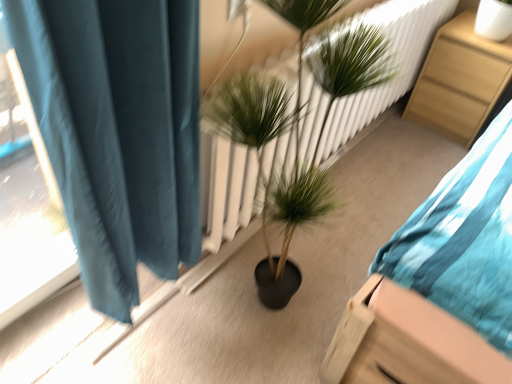
This screenshot has width=512, height=384. What do you see at coordinates (276, 181) in the screenshot?
I see `green leafy plant at center` at bounding box center [276, 181].

Locate an element on the screen. green leafy plant at center is located at coordinates (276, 181).

Looking at this image, measure the distance between point [472,62] and camera.

Point [472,62] and camera are 2.10 meters apart.

What do you see at coordinates (459, 80) in the screenshot? The height and width of the screenshot is (384, 512). I see `wooden nightstand at right` at bounding box center [459, 80].

The width and height of the screenshot is (512, 384). Identify the location of wooden nightstand at right. (459, 80).

What is the approximate width of wooden nightstand at right?

The width of wooden nightstand at right is 18.06 inches.

This screenshot has height=384, width=512. Find the location of `green leafy plant at center`. green leafy plant at center is located at coordinates (276, 181).

Is green leafy plant at center at the left side of wooden nightstand at right?

Correct, you'll find green leafy plant at center to the left of wooden nightstand at right.

Which object is closer to the camera, green leafy plant at center or wooden nightstand at right?

green leafy plant at center is more forward.

Does point (331, 7) come closer to viewer compared to point (486, 90)?

Yes, point (331, 7) is in front of point (486, 90).

From the image's perspective, does green leafy plant at center appear lower than wooden nightstand at right?

Yes.

From a real-world perspective, who is located lower, green leafy plant at center or wooden nightstand at right?

wooden nightstand at right.

Considering the sizes of objects green leafy plant at center and wooden nightstand at right in the image provided, who is thinner, green leafy plant at center or wooden nightstand at right?

green leafy plant at center is thinner.

Between green leafy plant at center and wooden nightstand at right, which one has less height?

wooden nightstand at right.

Between green leafy plant at center and wooden nightstand at right, which one has smaller size?

With smaller size is wooden nightstand at right.

Is green leafy plant at center completely or partially outside of wooden nightstand at right?

Absolutely, green leafy plant at center is external to wooden nightstand at right.

Is green leafy plant at center far from wooden nightstand at right?

green leafy plant at center is far away from wooden nightstand at right.

Is green leafy plant at center facing towards wooden nightstand at right?

No, green leafy plant at center is not oriented towards wooden nightstand at right.

How many degrees apart are the facing directions of green leafy plant at center and wooden nightstand at right?

The facing directions of green leafy plant at center and wooden nightstand at right are 95.8 degrees apart.

How far apart are green leafy plant at center and wooden nightstand at right?

green leafy plant at center is 1.19 meters from wooden nightstand at right.

Where is `houseplant that is above the wooden nightstand at right (from a real-world perspective)`? The height and width of the screenshot is (384, 512). houseplant that is above the wooden nightstand at right (from a real-world perspective) is located at coordinates (276, 181).

Is wooden nightstand at right to the right of green leafy plant at center from the viewer's perspective?

Yes.

Does wooden nightstand at right come behind green leafy plant at center?

Yes, wooden nightstand at right is behind green leafy plant at center.

Considering the points (432, 62) and (234, 90), which point is behind, point (432, 62) or point (234, 90)?

The point (432, 62) is more distant.

From the image's perspective, would you say wooden nightstand at right is positioned over green leafy plant at center?

Indeed, from the image's perspective, wooden nightstand at right is shown above green leafy plant at center.

From a real-world perspective, is wooden nightstand at right positioned over green leafy plant at center based on gravity?

No, from a real-world perspective, wooden nightstand at right is not on top of green leafy plant at center.

Looking at this image, between wooden nightstand at right and green leafy plant at center, which one has larger width?

With larger width is wooden nightstand at right.

Can you confirm if wooden nightstand at right is shorter than green leafy plant at center?

Yes.

Is wooden nightstand at right bigger than green leafy plant at center?

No, wooden nightstand at right is not bigger than green leafy plant at center.

Would you say wooden nightstand at right is inside or outside green leafy plant at center?

wooden nightstand at right is spatially situated outside green leafy plant at center.

Can you see wooden nightstand at right touching green leafy plant at center?

wooden nightstand at right and green leafy plant at center are clearly separated.

From the picture: Is wooden nightstand at right oriented towards green leafy plant at center?

Yes, wooden nightstand at right faces towards green leafy plant at center.

Identify the location of houseplant on the left of wooden nightstand at right. (276, 181).

Find the location of a particular element. This screenshot has height=384, width=512. furniture on the right of the green leafy plant at center is located at coordinates (459, 80).

What are the coordinates of `houseplant in front of the wooden nightstand at right` in the screenshot? It's located at (276, 181).